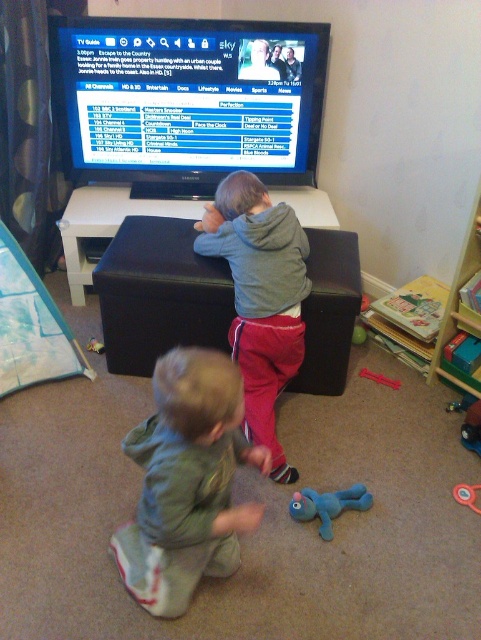
Question: Estimate the real-world distances between objects in this image. Which object is closer to the green soft hoodie at lower center?

Choices:
 (A) rubberized plastic toy at lower center
 (B) rubber duck at lower center
 (C) matte black tv guide at upper center

Answer: (B)

Question: Does gray fleece hoodie at center lie in front of rubberized plastic toy at lower center?

Choices:
 (A) no
 (B) yes

Answer: (B)

Question: Which is farther from the rubber ring at lower right?

Choices:
 (A) rubber green ball at center
 (B) rubberized plastic toy at lower center

Answer: (A)

Question: Is rubberized plastic toy at lower center smaller than rubber duck at lower center?

Choices:
 (A) no
 (B) yes

Answer: (A)

Question: Which of the following is the farthest from the observer?

Choices:
 (A) (296, 496)
 (B) (476, 486)

Answer: (B)

Question: Does rubber ring at lower right appear on the right side of rubber green ball at center?

Choices:
 (A) no
 (B) yes

Answer: (B)